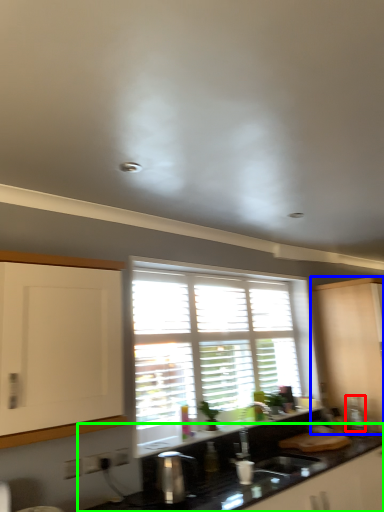
Question: Considering the real-world distances, which object is farthest from appliance (highlighted by a red box)? cabinetry (highlighted by a blue box) or countertop (highlighted by a green box)?

Choices:
 (A) cabinetry
 (B) countertop

Answer: (B)